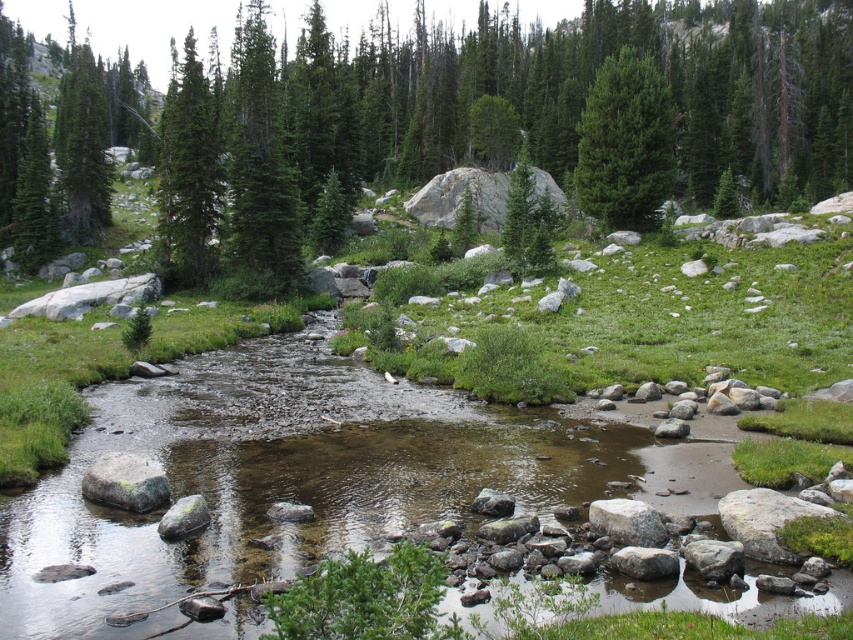
Between green matte tree at center and green matte tree at upper center, which one is positioned higher?

A: Positioned higher is green matte tree at center.

Can you confirm if green matte tree at center is positioned to the right of green matte tree at upper center?

Incorrect, green matte tree at center is not on the right side of green matte tree at upper center.

I want to click on green matte tree at center, so click(585, 102).

Which is more to the left, green matte tree at center or smooth gray rock at center?

smooth gray rock at center

Is green matte tree at center wider than smooth gray rock at center?

Correct, the width of green matte tree at center exceeds that of smooth gray rock at center.

Find the location of a particular element. This screenshot has height=640, width=853. green matte tree at center is located at coordinates (585, 102).

Is green matte tree at center above gray rough rock at lower left?

Correct, green matte tree at center is located above gray rough rock at lower left.

Measure the distance from green matte tree at center to gray rough rock at lower left.

green matte tree at center and gray rough rock at lower left are 74.83 meters apart from each other.

In order to click on green matte tree at center in this screenshot , I will do `click(585, 102)`.